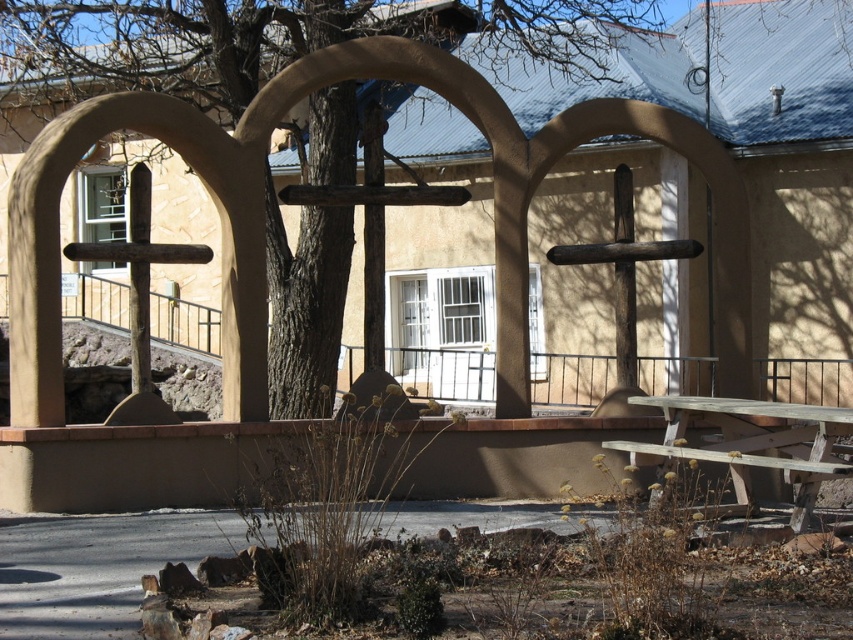
From the picture: Does brown rough tree at center lie behind wooden picnic table at lower right?

Yes, it is.

Between point (251, 278) and point (659, 449), which one is positioned in front?

Positioned in front is point (659, 449).

Who is more distant from viewer, (666, 141) or (836, 444)?

Positioned behind is point (666, 141).

The height and width of the screenshot is (640, 853). In order to click on brown rough tree at center in this screenshot , I will do `click(263, 212)`.